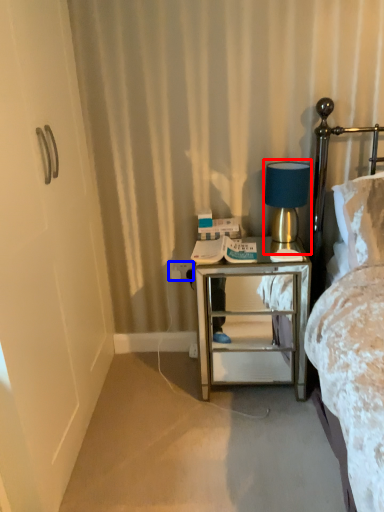
Question: Which of the following is the farthest to the observer, table lamp (highlighted by a red box) or electric outlet (highlighted by a blue box)?

Choices:
 (A) table lamp
 (B) electric outlet

Answer: (B)